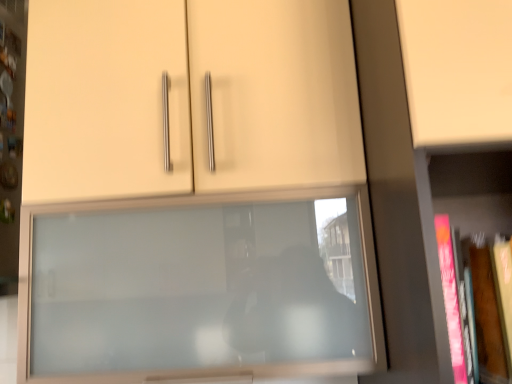
Question: Is pink matte book at right positioned beyond the bounds of hardcover book at right?

Choices:
 (A) yes
 (B) no

Answer: (A)

Question: Is pink matte book at right far away from hardcover book at right?

Choices:
 (A) yes
 (B) no

Answer: (B)

Question: Does pink matte book at right lie behind hardcover book at right?

Choices:
 (A) no
 (B) yes

Answer: (A)

Question: Considering the relative sizes of pink matte book at right and hardcover book at right in the image provided, is pink matte book at right taller than hardcover book at right?

Choices:
 (A) yes
 (B) no

Answer: (A)

Question: Does pink matte book at right come in front of hardcover book at right?

Choices:
 (A) yes
 (B) no

Answer: (A)

Question: Does point (464, 370) appear closer or farther from the camera than point (75, 178)?

Choices:
 (A) farther
 (B) closer

Answer: (B)

Question: Considering the positions of hardcover book at right and matte glass cupboard at center in the image, is hardcover book at right wider or thinner than matte glass cupboard at center?

Choices:
 (A) wide
 (B) thin

Answer: (B)

Question: From a real-world perspective, is hardcover book at right physically located above or below matte glass cupboard at center?

Choices:
 (A) above
 (B) below

Answer: (B)

Question: Would you say hardcover book at right is to the left or to the right of matte glass cupboard at center in the picture?

Choices:
 (A) left
 (B) right

Answer: (B)

Question: Is matte glass cupboard at center inside the boundaries of pink matte book at right, or outside?

Choices:
 (A) inside
 (B) outside

Answer: (B)

Question: Based on their sizes in the image, would you say matte glass cupboard at center is bigger or smaller than pink matte book at right?

Choices:
 (A) big
 (B) small

Answer: (B)

Question: Would you say matte glass cupboard at center is to the left or to the right of pink matte book at right in the picture?

Choices:
 (A) right
 (B) left

Answer: (B)

Question: From the image's perspective, is matte glass cupboard at center above or below pink matte book at right?

Choices:
 (A) below
 (B) above

Answer: (A)

Question: Considering the positions of pink matte book at right and hardcover book at right in the image, is pink matte book at right wider or thinner than hardcover book at right?

Choices:
 (A) thin
 (B) wide

Answer: (B)

Question: Considering the positions of pink matte book at right and hardcover book at right in the image, is pink matte book at right bigger or smaller than hardcover book at right?

Choices:
 (A) small
 (B) big

Answer: (B)